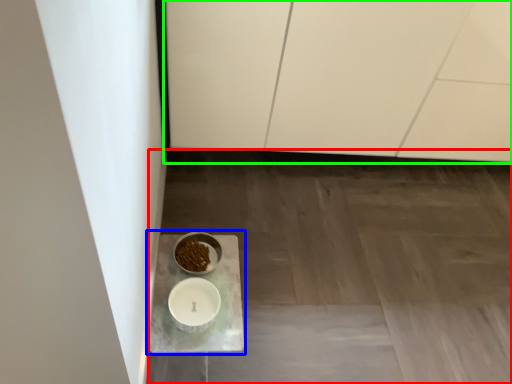
Question: Based on their relative distances, which object is nearer to concrete (highlighted by a red box)? Choose from table (highlighted by a blue box) and cabinetry (highlighted by a green box).

Choices:
 (A) table
 (B) cabinetry

Answer: (A)